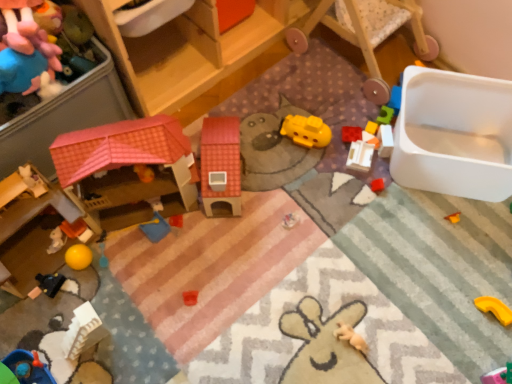
The image size is (512, 384). Identify the location of vacant space positioned to the left of yellow rubber toy at lower right, positioned as the 11th toy in left-to-right order. (433, 314).